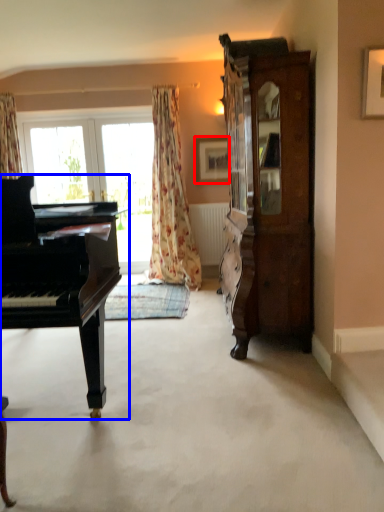
Question: Which of the following is the farthest to the observer, picture frame (highlighted by a red box) or piano (highlighted by a blue box)?

Choices:
 (A) picture frame
 (B) piano

Answer: (A)